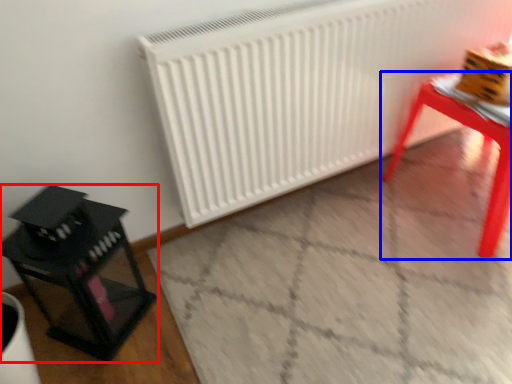
Question: Among these objects, which one is farthest to the camera, furniture (highlighted by a red box) or table (highlighted by a blue box)?

Choices:
 (A) furniture
 (B) table

Answer: (B)